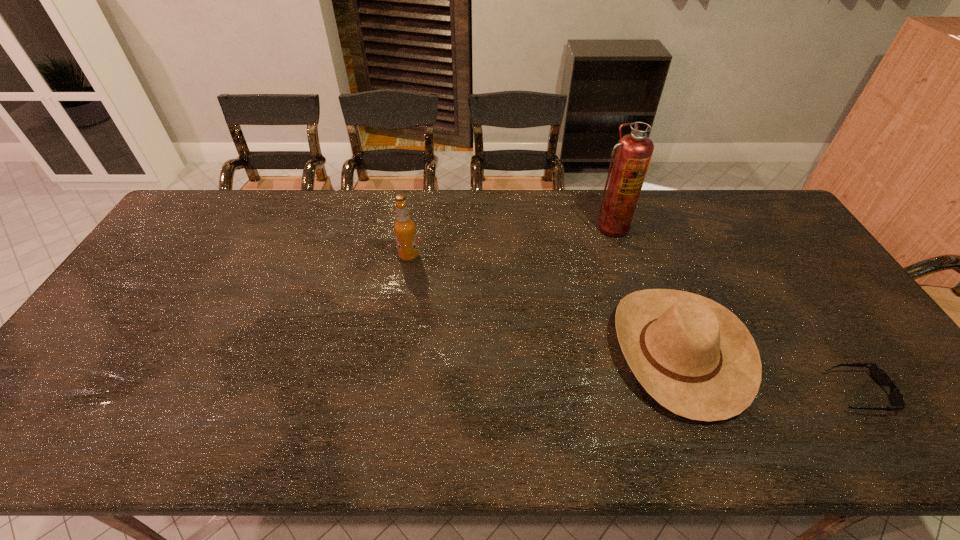
Locate an element on the screen. The width and height of the screenshot is (960, 540). the tallest object is located at coordinates (634, 151).

Find the location of a particular element. This screenshot has height=540, width=960. fire extinguisher is located at coordinates (634, 151).

The width and height of the screenshot is (960, 540). In order to click on the leftmost object in this screenshot , I will do `click(405, 228)`.

Identify the location of the second tallest object. (405, 228).

I want to click on the second shortest object, so click(696, 358).

Where is `the rightmost object`? the rightmost object is located at coordinates (880, 376).

The image size is (960, 540). What are the coordinates of `sunglasses` in the screenshot? It's located at (880, 376).

You are a GUI agent. You are given a task and a screenshot of the screen. Output one action in this format:
    pyautogui.click(x=<x>, y=<y>)
    Task: Click on the vacant space located 0.300m on the side of the tallest object with the label
    This screenshot has height=540, width=960.
    Given the screenshot: What is the action you would take?
    pyautogui.click(x=636, y=310)

Where is `free space located 0.250m on the front label of the second farthest object`? This screenshot has height=540, width=960. free space located 0.250m on the front label of the second farthest object is located at coordinates (499, 256).

Find the location of a particular element. free space located 0.220m on the front-facing side of the cowboy hat is located at coordinates coord(528,351).